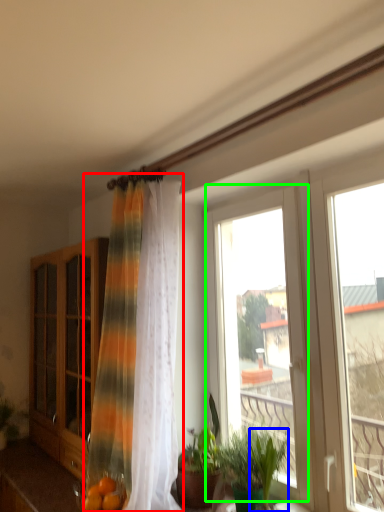
Question: Which is nearer to the curtain (highlighted by a red box)? plant (highlighted by a blue box) or window (highlighted by a green box).

Choices:
 (A) plant
 (B) window

Answer: (B)